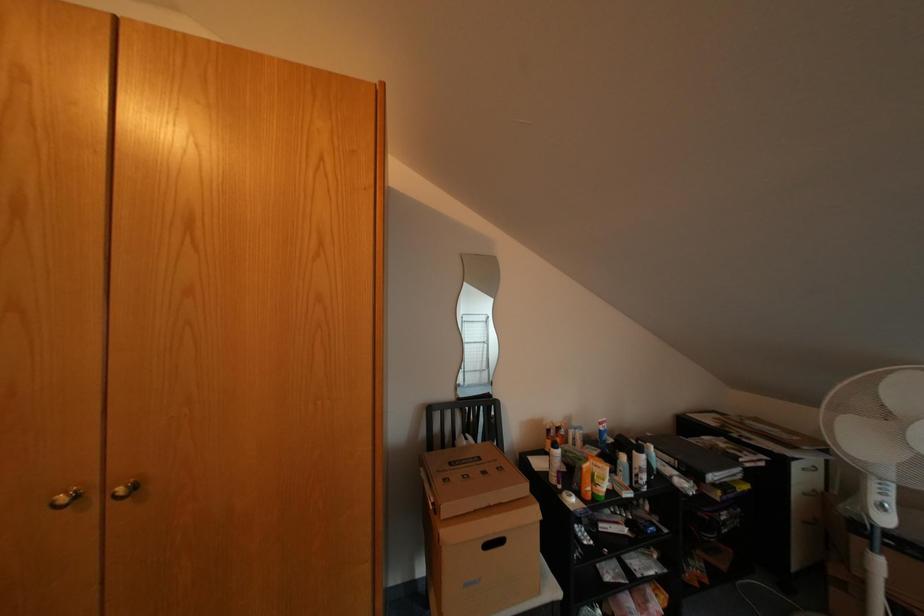
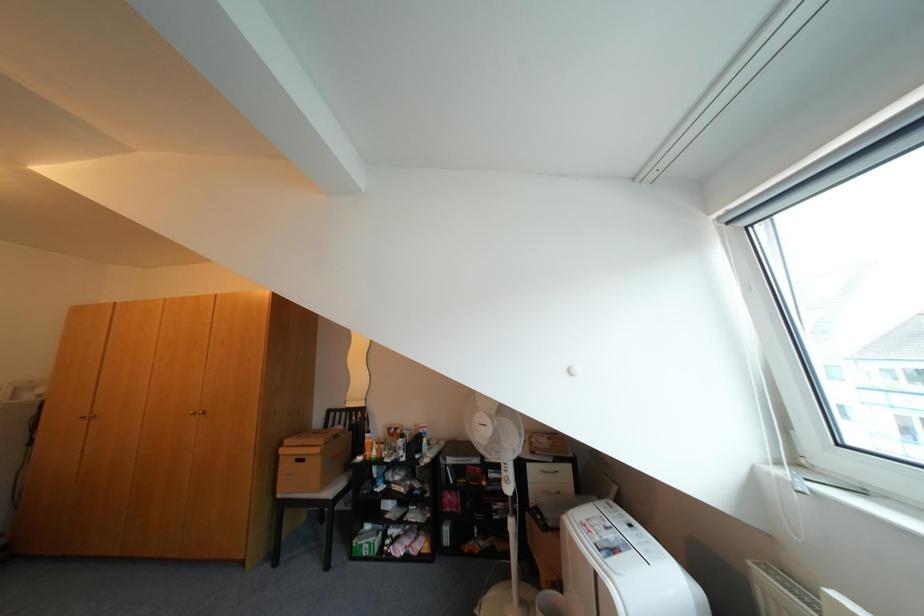
Question: In a continuous first-person perspective shot, in which direction is the camera moving?

Choices:
 (A) Left
 (B) Right
 (C) Forward
 (D) Backward

Answer: (B)